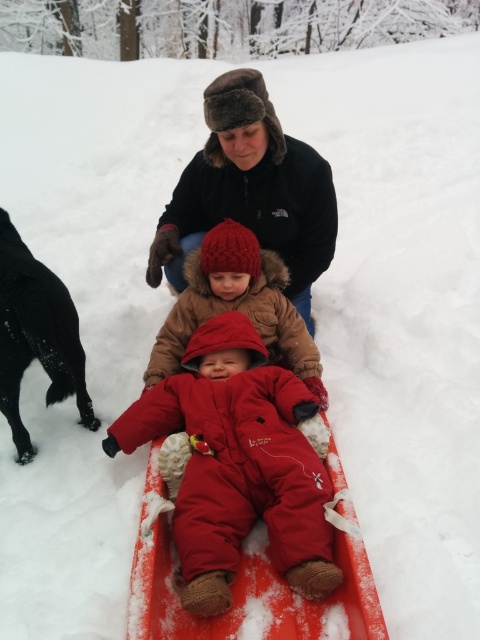
Is matte red snowsuit at center below red fuzzy hat at center?

Indeed, matte red snowsuit at center is positioned under red fuzzy hat at center.

Can you confirm if matte red snowsuit at center is wider than red fuzzy hat at center?

Indeed, matte red snowsuit at center has a greater width compared to red fuzzy hat at center.

You are a GUI agent. You are given a task and a screenshot of the screen. Output one action in this format:
    pyautogui.click(x=<x>, y=<y>)
    Task: Click on the matte red snowsuit at center
    The height and width of the screenshot is (640, 480).
    Given the screenshot: What is the action you would take?
    pyautogui.click(x=238, y=465)

Where is `matte red snowsuit at center`? The height and width of the screenshot is (640, 480). matte red snowsuit at center is located at coordinates (238, 465).

Between matte red snowsuit at center and black fur dog at left, which one is positioned lower?

matte red snowsuit at center is below.

Can you confirm if matte red snowsuit at center is positioned above black fur dog at left?

Incorrect, matte red snowsuit at center is not positioned above black fur dog at left.

Is point (146, 410) positioned after point (75, 369)?

That is False.

In order to click on matte red snowsuit at center in this screenshot , I will do `click(238, 465)`.

Is black fur-lined hat at upper center wider than red fuzzy hat at center?

Correct, the width of black fur-lined hat at upper center exceeds that of red fuzzy hat at center.

Which is in front, point (271, 234) or point (240, 266)?

Positioned in front is point (240, 266).

Which is in front, point (305, 301) or point (239, 264)?

Positioned in front is point (239, 264).

Identify the location of black fur-lined hat at upper center. This screenshot has height=640, width=480. (251, 189).